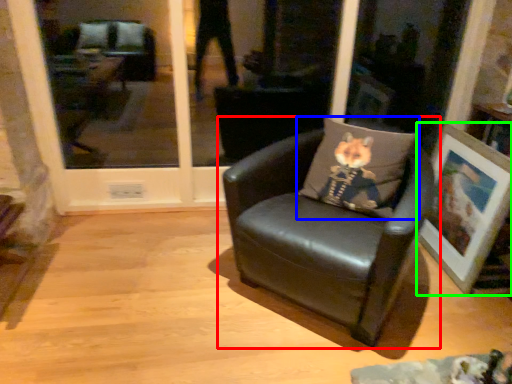
Question: Based on their relative distances, which object is farther from chair (highlighted by a red box)? Choose from pillow (highlighted by a blue box) and picture frame (highlighted by a green box).

Choices:
 (A) pillow
 (B) picture frame

Answer: (B)